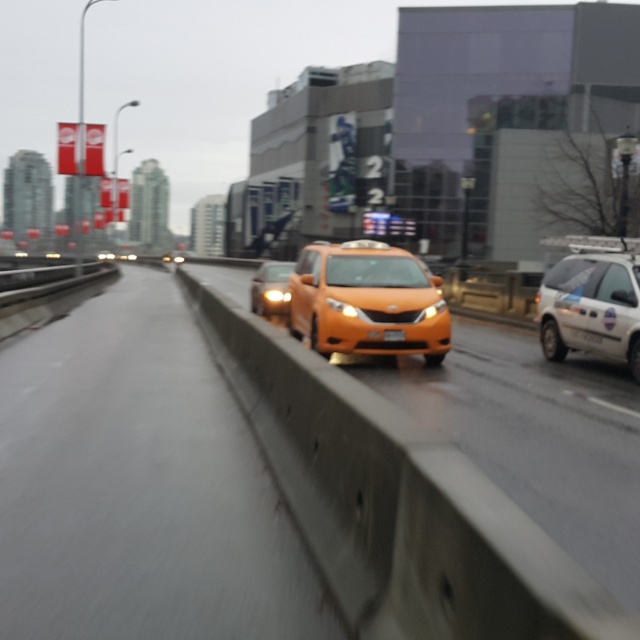
You are a pedestrian trying to cross the road and see the orange glossy taxi at right and the matte black sedan at center. Which vehicle is closer to you?

The orange glossy taxi at right is smaller in size compared to the matte black sedan at center, which might indicate it is farther away. However, based on the description provided, the matte black sedan at center is closer to you since it is positioned at the center of the scene, while the orange glossy taxi at right is placed towards the right side. The size difference alone does not determine proximity in this context.

You are a driver approaching the matte orange taxi at center and need to read its yellow plastic license plate at center. Considering the height difference between the two, would you need to adjust your head position to look down or up to read the license plate?

The matte orange taxi at center is taller than the yellow plastic license plate at center, so you would need to look down to read the license plate.